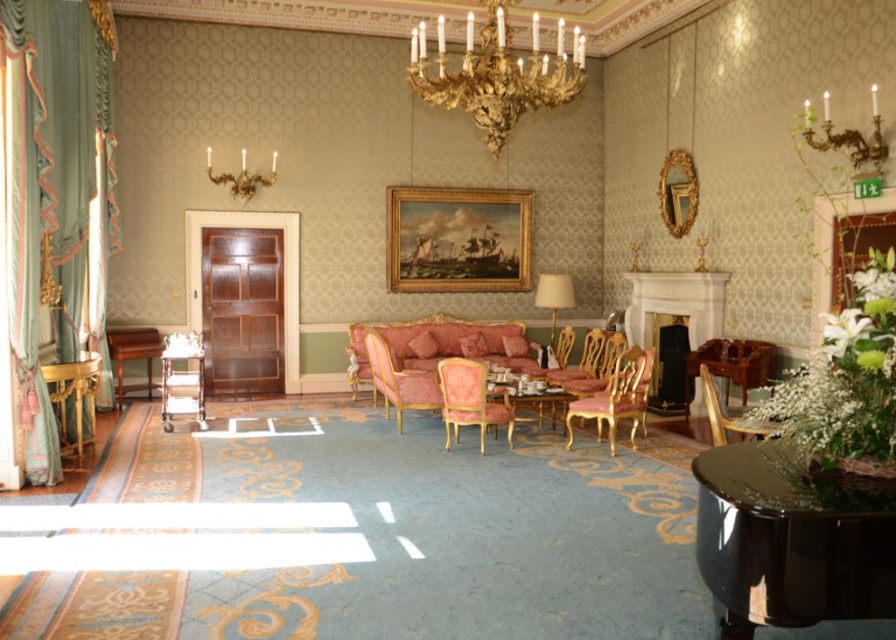
Question: Considering the real-world distances, which object is farthest from the wooden armchair at center?

Choices:
 (A) gold-framed painting at upper center
 (B) metallic gold armchair at lower left
 (C) matte pink fabric armchair at center

Answer: (A)

Question: Which object is the closest to the gold metallic chandelier at upper center?

Choices:
 (A) gold metallic armchair at center
 (B) metallic gold armchair at lower left
 (C) mahogany desk at right

Answer: (B)

Question: Considering the relative positions of mahogany desk at right and gold metallic chandelier at upper center in the image provided, where is mahogany desk at right located with respect to gold metallic chandelier at upper center?

Choices:
 (A) left
 (B) right

Answer: (B)

Question: Estimate the real-world distances between objects in this image. Which object is closer to the velvet pink couch at center?

Choices:
 (A) gold-framed painting at upper center
 (B) metallic gold armchair at lower left
 (C) gold metallic chandelier at upper center
 (D) matte pink fabric armchair at center

Answer: (A)

Question: Does glossy black piano at lower right have a smaller size compared to wooden table at left?

Choices:
 (A) no
 (B) yes

Answer: (B)

Question: Is velvet pink armchair at center bigger than wooden armchair at center?

Choices:
 (A) yes
 (B) no

Answer: (A)